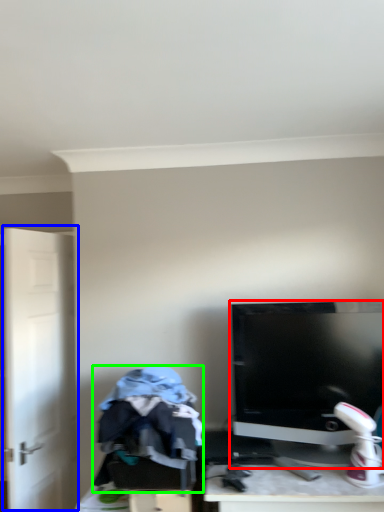
Question: Which object is positioned closest to computer monitor (highlighted by a red box)? Select from door (highlighted by a blue box) and clothing (highlighted by a green box).

Choices:
 (A) door
 (B) clothing

Answer: (B)